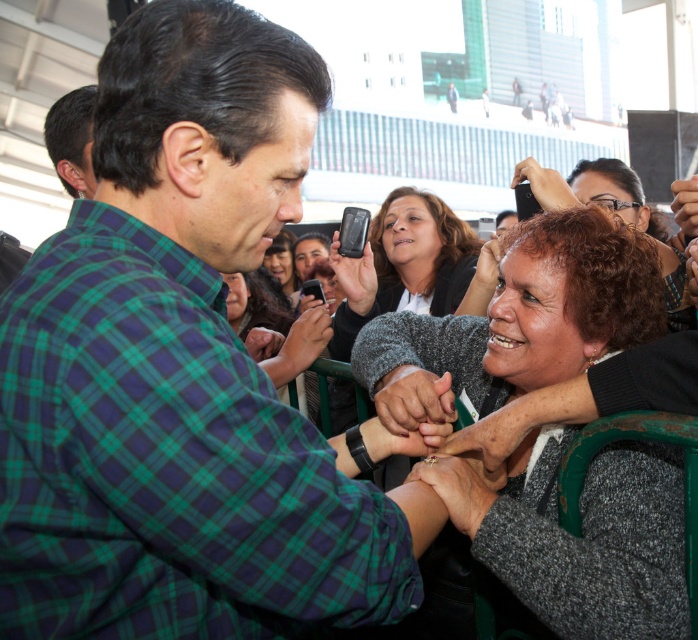
Is matte black phone at center wider than black matte phone at center?

Indeed, matte black phone at center has a greater width compared to black matte phone at center.

Is the position of matte black phone at center more distant than that of black matte phone at center?

No.

At what (x,y) coordinates should I click in order to perform the action: click on matte black phone at center. Please return your answer as a coordinate pair (x, y). The height and width of the screenshot is (640, 698). Looking at the image, I should click on (304, 342).

From the picture: Can you confirm if gray textured sweater at center is smaller than black matte phone at upper right?

Yes, gray textured sweater at center is smaller than black matte phone at upper right.

Consider the image. Is gray textured sweater at center to the left of black matte phone at upper right from the viewer's perspective?

Correct, you'll find gray textured sweater at center to the left of black matte phone at upper right.

Find the location of a particular element. This screenshot has width=698, height=640. gray textured sweater at center is located at coordinates (524, 317).

Is gray textured sweater at center shorter than smooth skin face at center?

Yes.

Describe the element at coordinates (524, 317) in the screenshot. I see `gray textured sweater at center` at that location.

Between point (537, 257) and point (265, 264), which one is positioned in front?

Point (537, 257)

Where is `gray textured sweater at center`? The width and height of the screenshot is (698, 640). gray textured sweater at center is located at coordinates (524, 317).